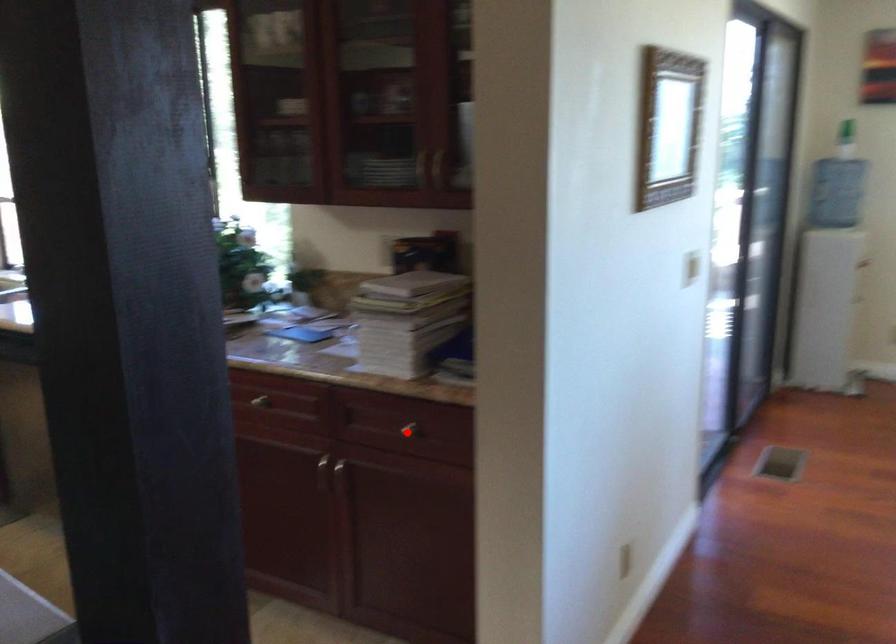
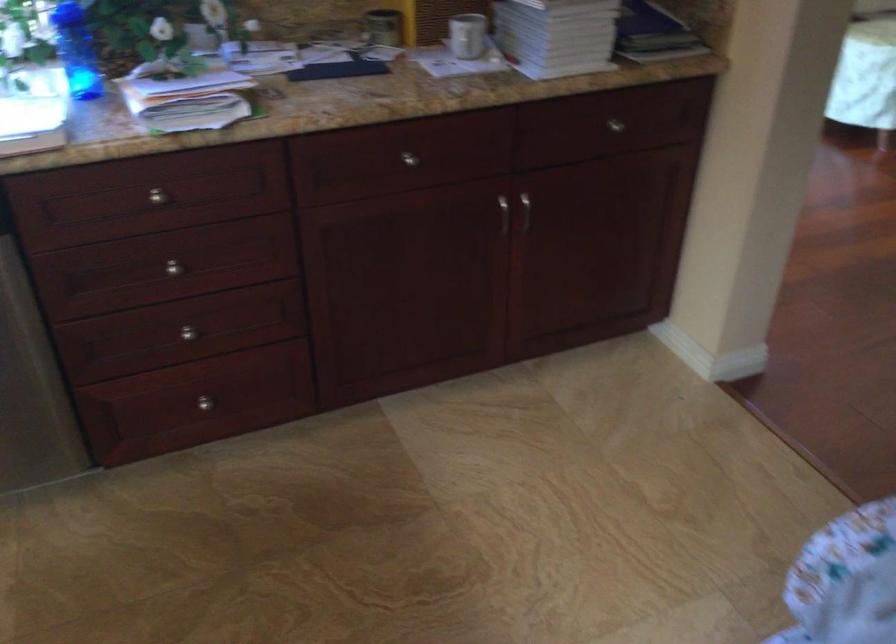
In the second image, find the point that corresponds to the highlighted location in the first image.

(615, 125)